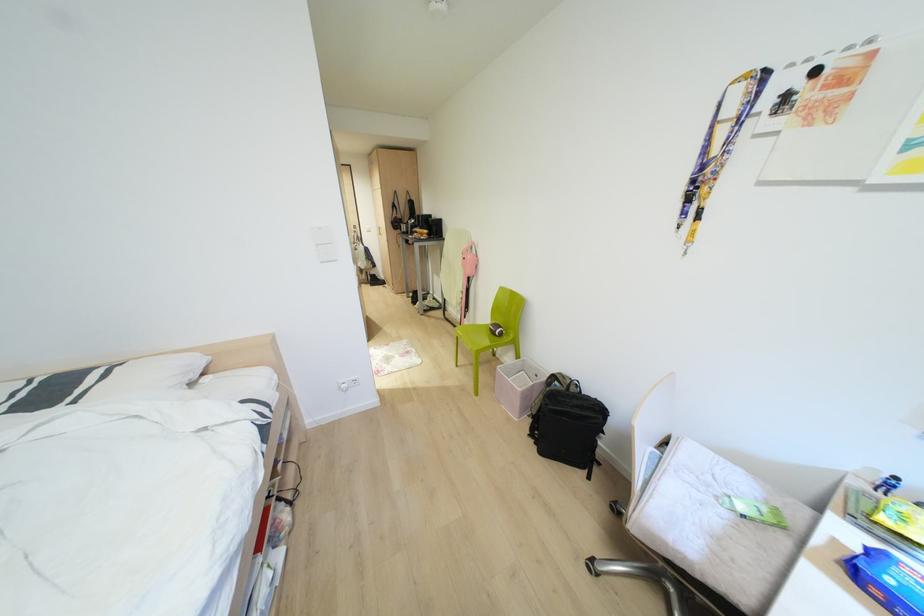
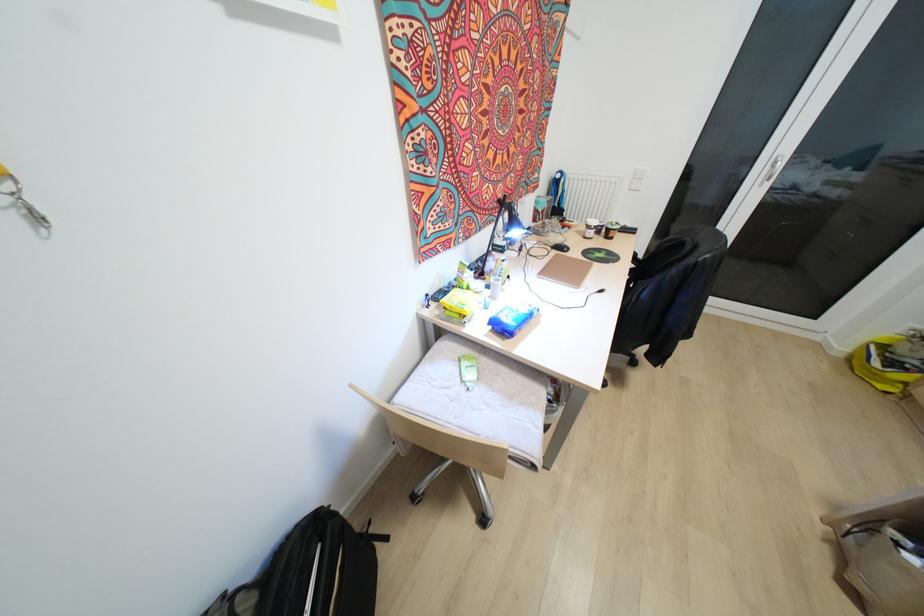
Find the pixel in the second image that matches pixel 589 477 in the first image.

(385, 538)